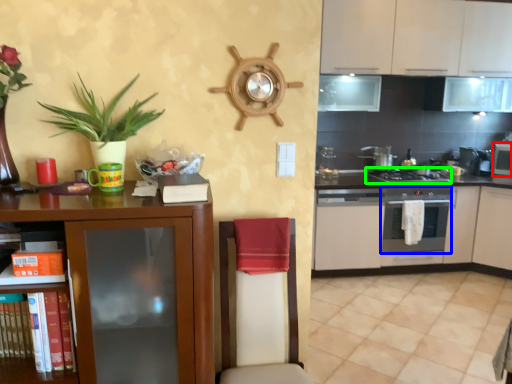
Question: Which object is positioned farthest from appliance (highlighted by a red box)? Select from kitchen appliance (highlighted by a blue box) and gas stove (highlighted by a green box).

Choices:
 (A) kitchen appliance
 (B) gas stove

Answer: (A)